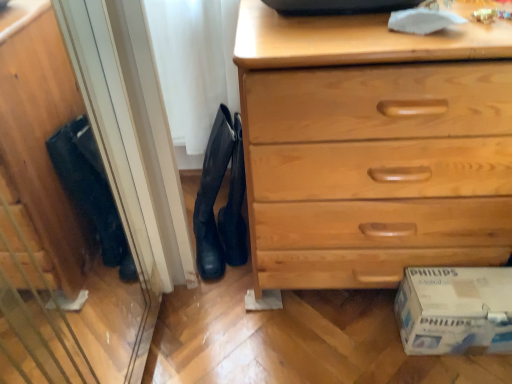
Measure the distance between black leather boots at center and camera.

The depth of black leather boots at center is 1.01 meters.

Find the location of a particular element. black leather boots at center is located at coordinates (234, 206).

Locate an element on the screen. The height and width of the screenshot is (384, 512). black leather boots at center is located at coordinates (234, 206).

How far apart are black suede boot at center and black leather boots at center?

black suede boot at center is 1.76 inches from black leather boots at center.

Find the location of a particular element. shoe that is above the black suede boot at center (from the image's perspective) is located at coordinates (234, 206).

Which of these two, black suede boot at center or black leather boots at center, is bigger?

black suede boot at center is bigger.

From the image's perspective, which one is positioned higher, black suede boot at center or black leather boots at center?

black leather boots at center, from the image's perspective.

Where is `chest of drawers in front of the black suede boot at center`? This screenshot has height=384, width=512. chest of drawers in front of the black suede boot at center is located at coordinates (372, 149).

Between point (231, 122) and point (287, 144), which one is positioned behind?

Positioned behind is point (231, 122).

Is black suede boot at center far from light wood chest of drawers at lower right?

black suede boot at center is actually quite close to light wood chest of drawers at lower right.

Who is bigger, black suede boot at center or light wood chest of drawers at lower right?

With larger size is light wood chest of drawers at lower right.

Does point (493, 334) come closer to viewer compared to point (234, 190)?

Yes, point (493, 334) is in front of point (234, 190).

From the image's perspective, is white cardboard box at lower right positioned above or below black leather boots at center?

white cardboard box at lower right is situated lower than black leather boots at center in the image.

From a real-world perspective, does white cardboard box at lower right stand above black leather boots at center?

No, from a real-world perspective, white cardboard box at lower right is not over black leather boots at center

Is white cardboard box at lower right far from black leather boots at center?

No, white cardboard box at lower right is not far from black leather boots at center.

Which of these two, white cardboard box at lower right or light wood chest of drawers at lower right, is bigger?

With larger size is light wood chest of drawers at lower right.

Considering their positions, is white cardboard box at lower right located in front of or behind light wood chest of drawers at lower right?

white cardboard box at lower right is positioned farther from the viewer than light wood chest of drawers at lower right.

Between white cardboard box at lower right and light wood chest of drawers at lower right, which one appears on the left side from the viewer's perspective?

Positioned to the left is light wood chest of drawers at lower right.

From the image's perspective, is white cardboard box at lower right positioned above or below light wood chest of drawers at lower right?

white cardboard box at lower right is below light wood chest of drawers at lower right.

Is black leather boots at center spatially inside light wood chest of drawers at lower right, or outside of it?

black leather boots at center is not enclosed by light wood chest of drawers at lower right.

Is there a large distance between black leather boots at center and light wood chest of drawers at lower right?

black leather boots at center is near light wood chest of drawers at lower right, not far away.

In terms of height, does black leather boots at center look taller or shorter compared to light wood chest of drawers at lower right?

black leather boots at center is shorter than light wood chest of drawers at lower right.

Between black leather boots at center and light wood chest of drawers at lower right, which one appears on the left side from the viewer's perspective?

Positioned to the left is black leather boots at center.

Between white cardboard box at lower right and black suede boot at center, which one appears on the right side from the viewer's perspective?

From the viewer's perspective, white cardboard box at lower right appears more on the right side.

Is white cardboard box at lower right thinner than black suede boot at center?

Yes.

Is white cardboard box at lower right oriented away from black suede boot at center?

No.

Is white cardboard box at lower right completely or partially outside of black suede boot at center?

That's correct, white cardboard box at lower right is outside of black suede boot at center.

Which of these two, black leather boots at center or white cardboard box at lower right, stands taller?

With more height is black leather boots at center.

From the image's perspective, who appears lower, black leather boots at center or white cardboard box at lower right?

white cardboard box at lower right appears lower in the image.

Can you confirm if black leather boots at center is thinner than white cardboard box at lower right?

Incorrect, the width of black leather boots at center is not less than that of white cardboard box at lower right.

Where is `boot that appears below the black leather boots at center (from a real-world perspective)`? This screenshot has width=512, height=384. boot that appears below the black leather boots at center (from a real-world perspective) is located at coordinates (212, 196).

Identify the location of the chest of drawers that is above the black suede boot at center (from the image's perspective). (372, 149).

Considering their positions, is light wood chest of drawers at lower right positioned further to black leather boots at center than white cardboard box at lower right?

white cardboard box at lower right lies further to black leather boots at center than the other object.

Which object lies nearer to the anchor point light wood chest of drawers at lower right, white cardboard box at lower right or black suede boot at center?

Among the two, white cardboard box at lower right is located nearer to light wood chest of drawers at lower right.

Consider the image. Which object lies further to the anchor point white cardboard box at lower right, black suede boot at center or light wood chest of drawers at lower right?

black suede boot at center.

From the picture: From the image, which object appears to be farther from light wood chest of drawers at lower right, white cardboard box at lower right or black leather boots at center?

black leather boots at center lies further to light wood chest of drawers at lower right than the other object.

Looking at the image, which one is located closer to black leather boots at center, white cardboard box at lower right or black suede boot at center?

black suede boot at center is closer to black leather boots at center.

Considering their positions, is black suede boot at center positioned further to black leather boots at center than white cardboard box at lower right?

white cardboard box at lower right.

Looking at the image, which one is located further to black suede boot at center, black leather boots at center or light wood chest of drawers at lower right?

light wood chest of drawers at lower right.

When comparing their distances from white cardboard box at lower right, does black leather boots at center or black suede boot at center seem further?

black suede boot at center is positioned further to the anchor white cardboard box at lower right.

The width and height of the screenshot is (512, 384). What are the coordinates of `chest of drawers between black suede boot at center and white cardboard box at lower right from left to right` in the screenshot? It's located at (372, 149).

I want to click on shoe between black suede boot at center and white cardboard box at lower right, so click(234, 206).

In order to click on chest of drawers between black leather boots at center and white cardboard box at lower right in the horizontal direction in this screenshot , I will do `click(372, 149)`.

The image size is (512, 384). Find the location of `shoe between black suede boot at center and light wood chest of drawers at lower right in the horizontal direction`. shoe between black suede boot at center and light wood chest of drawers at lower right in the horizontal direction is located at coordinates (234, 206).